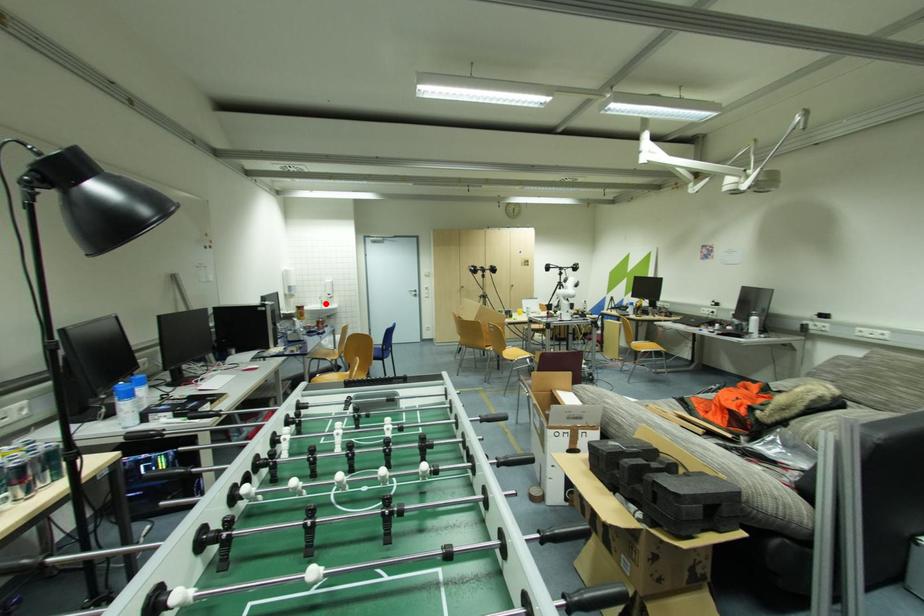
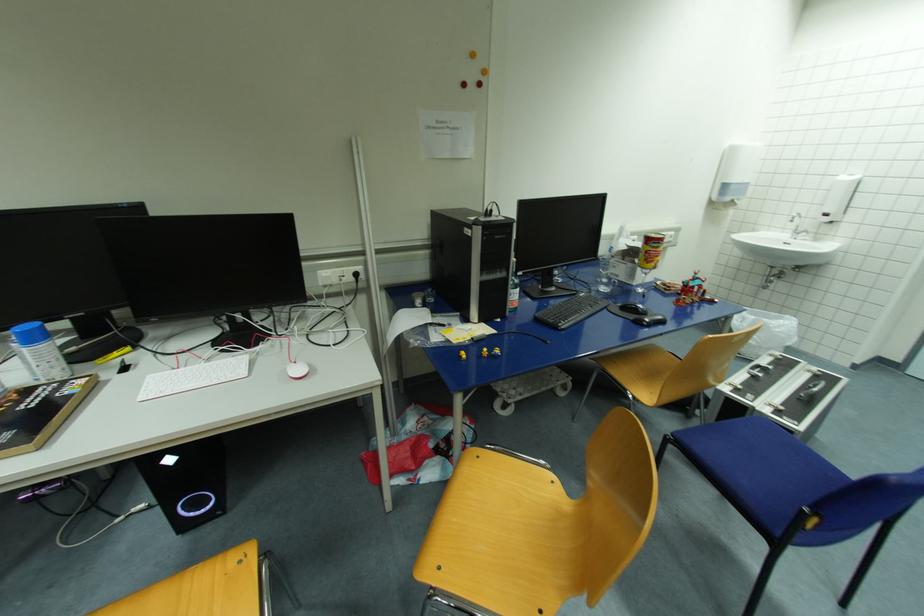
Question: I am providing you with two images of the same scene from different viewpoints. Image1 has a red point marked. In image2, the corresponding 3D location appears at what relative position? Reply with the corresponding letter.

Choices:
 (A) Closer
 (B) Farther

Answer: (B)